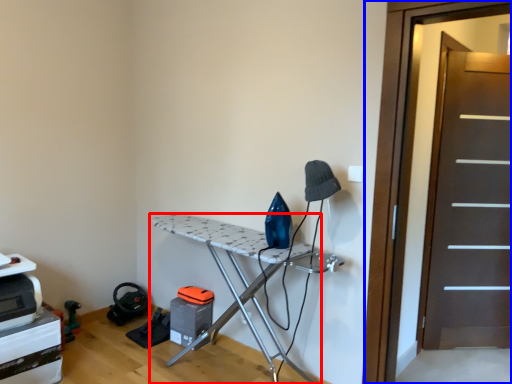
Question: Which point is closer to the camera, furniture (highlighted by a red box) or screen door (highlighted by a blue box)?

Choices:
 (A) furniture
 (B) screen door

Answer: (B)